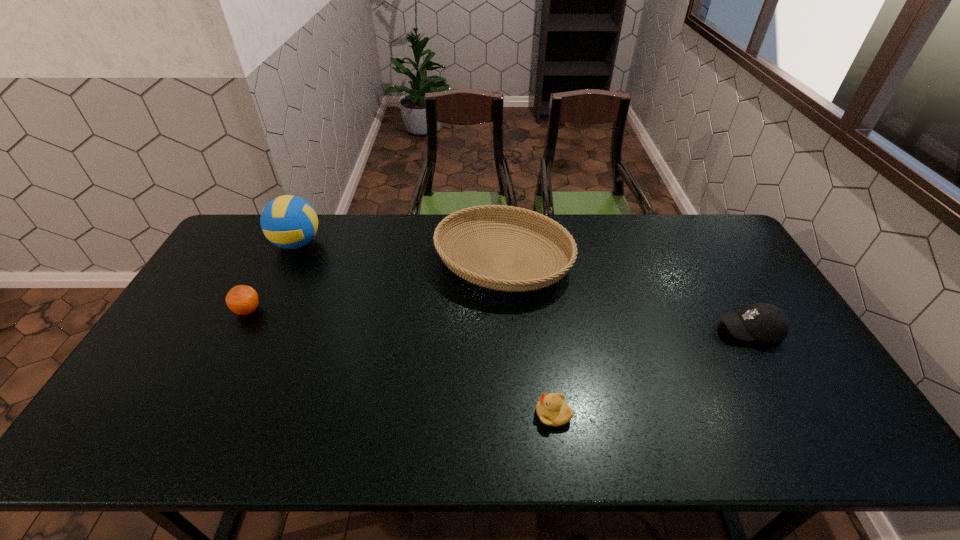
Identify the location of the tallest object. (290, 222).

Where is `basket`? basket is located at coordinates (493, 281).

This screenshot has width=960, height=540. In order to click on orange in this screenshot , I will do `click(243, 300)`.

What are the coordinates of `the rightmost object` in the screenshot? It's located at (765, 322).

Identify the location of duckling. The height and width of the screenshot is (540, 960). (552, 410).

Identify the location of the shortest object. (552, 410).

Find the location of `vacant space situated 0.130m on the right of the volleyball`. vacant space situated 0.130m on the right of the volleyball is located at coordinates pos(360,243).

Identify the location of vacant space located on the left of the basket. The height and width of the screenshot is (540, 960). (339, 261).

I want to click on free point located on the right of the orange, so click(363, 310).

Identify the location of vacant area situated on the front-facing side of the baseball cap. The width and height of the screenshot is (960, 540). (699, 330).